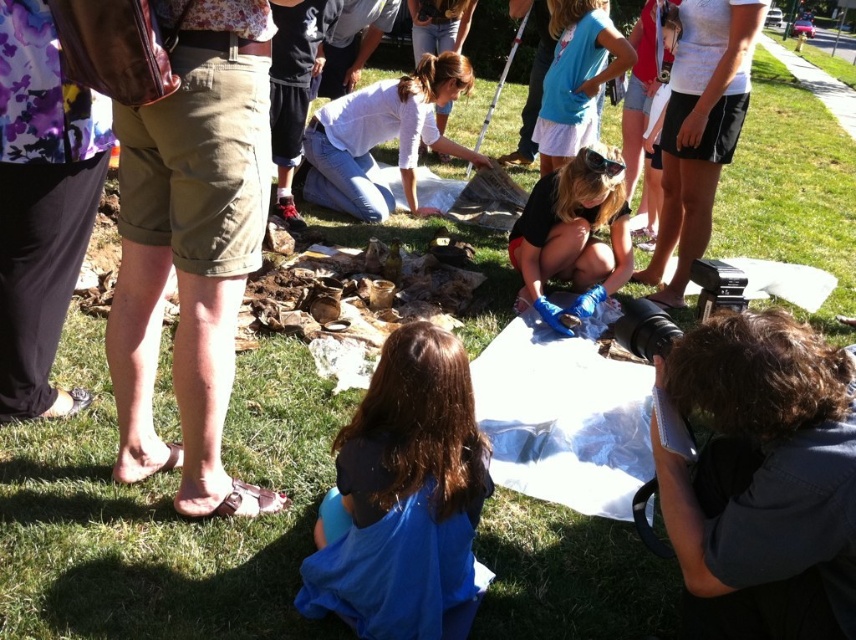
You are a photographer at the archaeological dig site. You want to take a photo of the white cotton shirt at center and the blue latex gloves at center. Which object should you focus on first to ensure both are in sharp focus?

You should focus on the white cotton shirt at center first because it is closer to the viewer than the blue latex gloves at center. By focusing on the closer object, the depth of field may help keep both in focus.

You are standing at the center of the archaeological dig site. There are two points marked on the ground at coordinates point (842, 436) and point (614, 282). Which point is closer to you?

Point (842, 436) is closer to the viewer than point (614, 282).

You are a photographer at the archaeological site. You need to take a photo that includes both the dark brown hair at lower center and the white cotton shirt at center. Which direction should you move to frame them both in the shot?

The dark brown hair at lower center is to the right of the white cotton shirt at center. To include both in the photo, you should move to the left so that both objects can be captured within the frame.